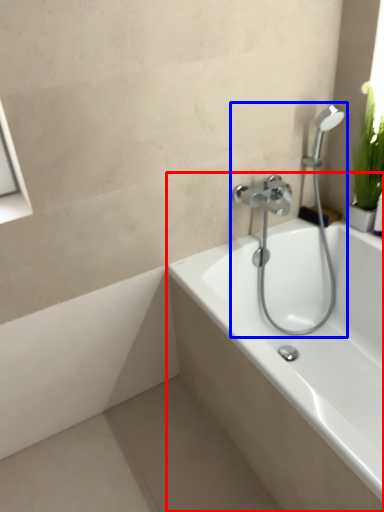
Question: Which object appears farthest to the camera in this image, bathtub (highlighted by a red box) or plumbing fixture (highlighted by a blue box)?

Choices:
 (A) bathtub
 (B) plumbing fixture

Answer: (B)